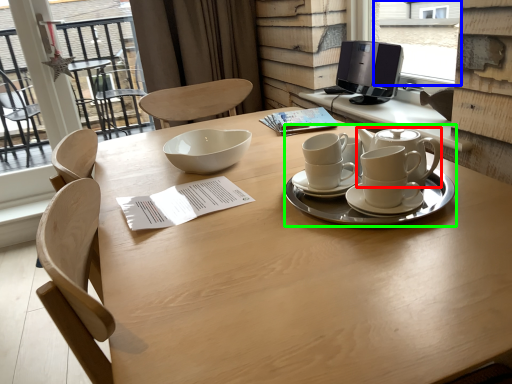
Question: Which object is positioned farthest from teapot (highlighted by a red box)? Select from window screen (highlighted by a blue box) and tableware (highlighted by a green box).

Choices:
 (A) window screen
 (B) tableware

Answer: (A)